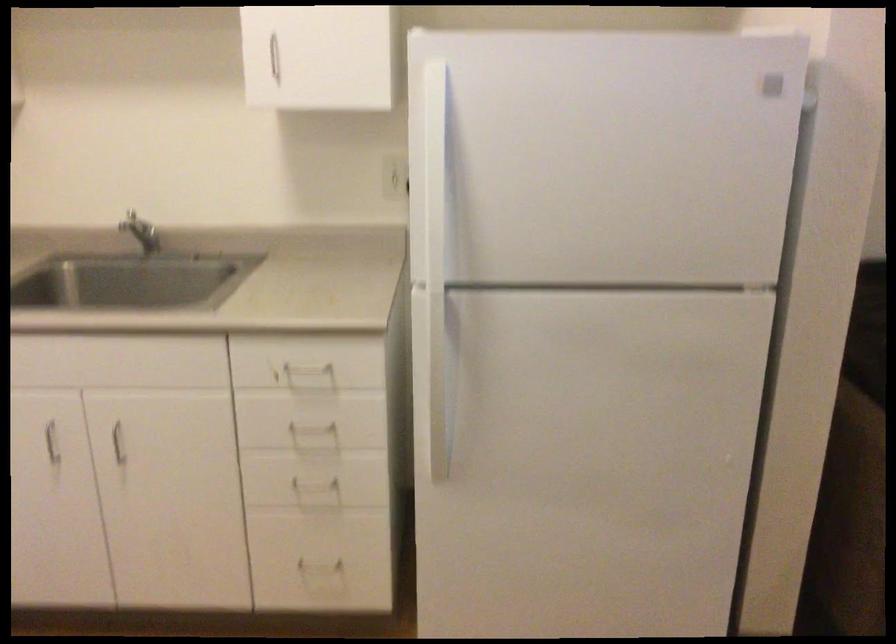
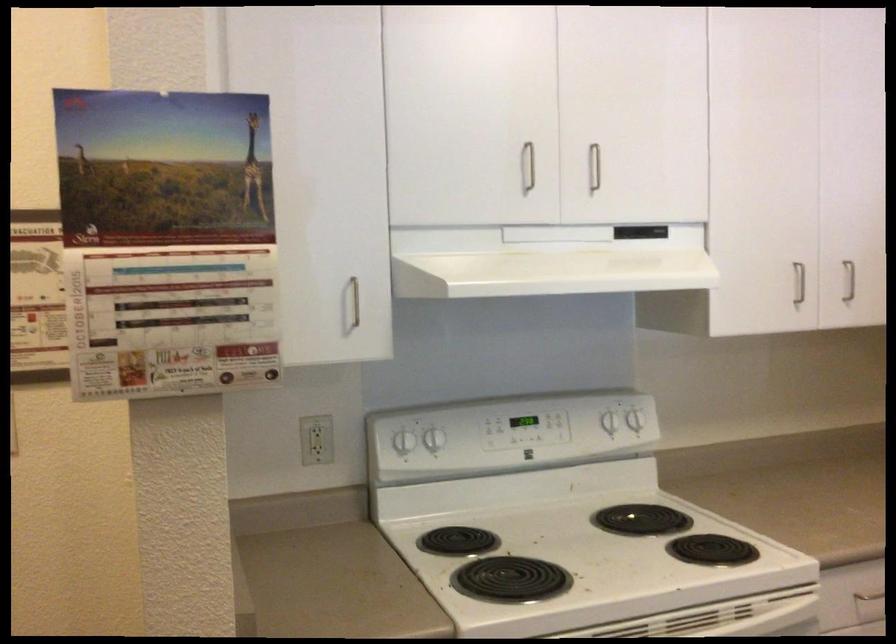
Question: The camera is either moving clockwise (left) or counter-clockwise (right) around the object. The first image is from the beginning of the video and the second image is from the end. Is the camera moving left or right when shooting the video?

Choices:
 (A) Left
 (B) Right

Answer: (B)